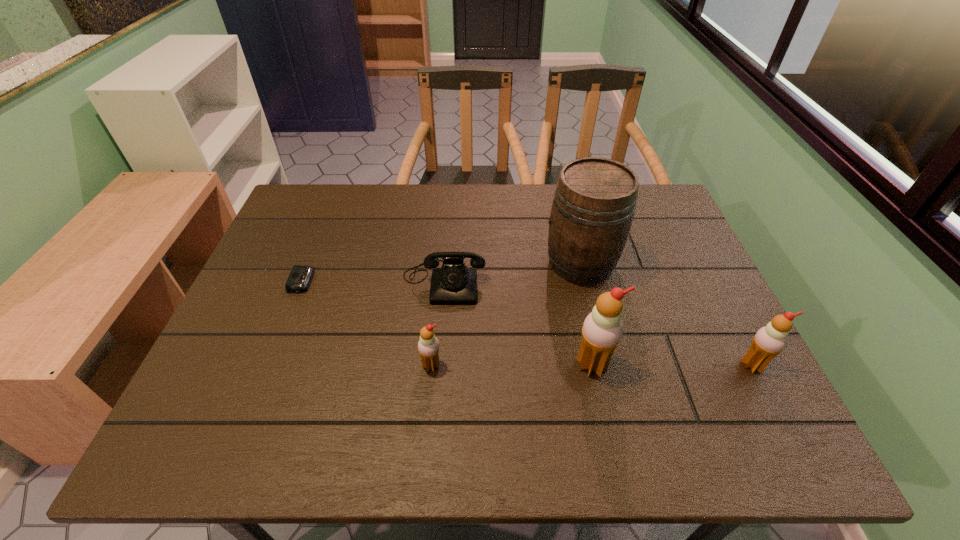
Where is `the fourth tallest object`? Image resolution: width=960 pixels, height=540 pixels. the fourth tallest object is located at coordinates (428, 346).

You are a GUI agent. You are given a task and a screenshot of the screen. Output one action in this format:
    pyautogui.click(x=<x>, y=<y>)
    Task: Click on the leftmost icecream
    The height and width of the screenshot is (540, 960).
    Given the screenshot: What is the action you would take?
    pyautogui.click(x=428, y=346)

Locate an element on the screen. This screenshot has width=960, height=540. the second icecream from left to right is located at coordinates (602, 330).

The width and height of the screenshot is (960, 540). I want to click on the second shortest icecream, so click(x=769, y=341).

Identify the location of the third tallest object. Image resolution: width=960 pixels, height=540 pixels. (769, 341).

Locate an element on the screen. telephone is located at coordinates (454, 283).

Locate an element on the screen. cider is located at coordinates (594, 203).

Where is `the leftmost object`? the leftmost object is located at coordinates (300, 277).

At what (x,y) coordinates should I click in order to perform the action: click on the shortest object. Please return your answer as a coordinate pair (x, y). The image size is (960, 540). Looking at the image, I should click on (300, 277).

Where is `free space located at the front with a straw on the leftmost icecream`? free space located at the front with a straw on the leftmost icecream is located at coordinates (428, 403).